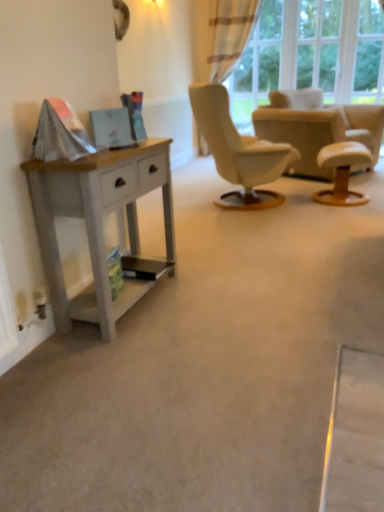
Identify the location of free location in front of white leather stool at right. This screenshot has height=512, width=384. (346, 215).